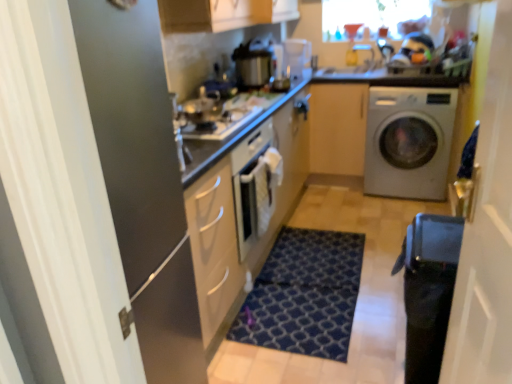
This screenshot has height=384, width=512. I want to click on free region on the left part of black glossy water heater at lower right, so click(x=361, y=362).